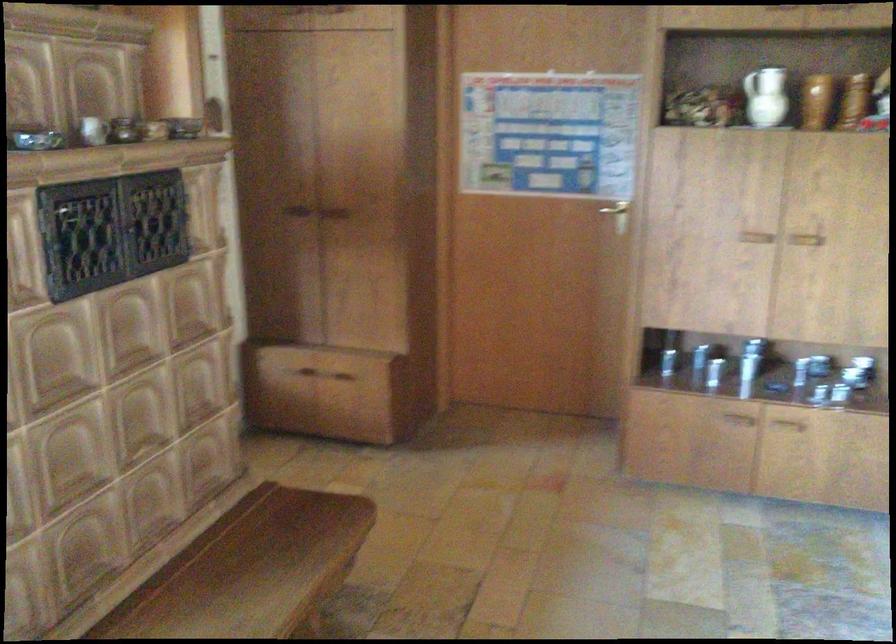
At what (x,y) coordinates should I click in order to perform the action: click on drawer handle. Please return your answer as a coordinate pair (x, y). This screenshot has width=896, height=644. Looking at the image, I should click on (303, 375).